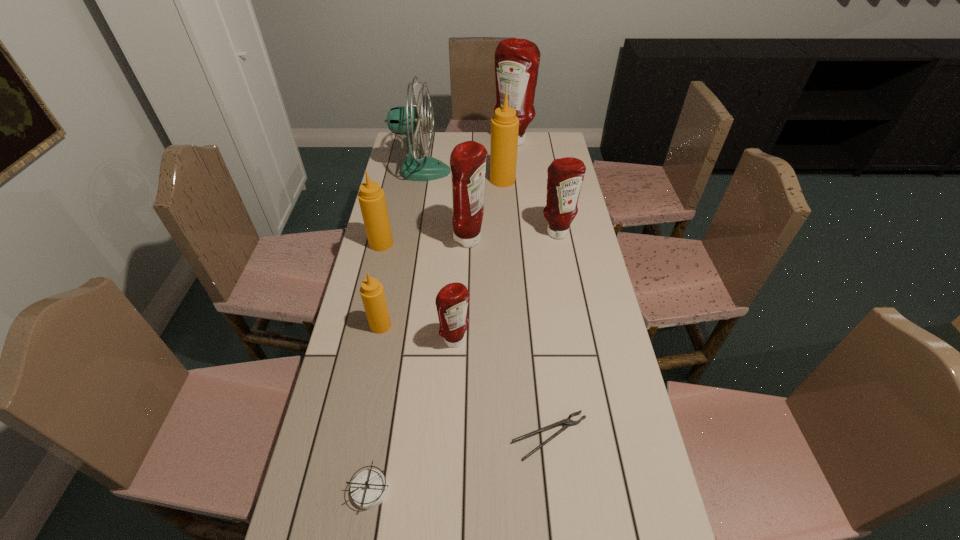
The height and width of the screenshot is (540, 960). Find the location of `the second shortest object`. the second shortest object is located at coordinates click(x=368, y=490).

Locate an element on the screen. Image resolution: width=960 pixels, height=540 pixels. the nearest object is located at coordinates (368, 490).

This screenshot has height=540, width=960. I want to click on the shortest object, so click(x=567, y=422).

Locate an element on the screen. The height and width of the screenshot is (540, 960). tongs is located at coordinates (567, 422).

In order to click on vacant space located 0.080m on the right of the tallest condiment in this screenshot , I will do `click(550, 142)`.

Locate an element on the screen. The height and width of the screenshot is (540, 960). blank area located 0.120m in front of the fan, directing airflow is located at coordinates (478, 171).

You are a GUI agent. You are given a task and a screenshot of the screen. Output one action in this format:
    pyautogui.click(x=<x>, y=<y>)
    Task: Click on the free space located on the right of the farthest tan condiment
    The height and width of the screenshot is (540, 960).
    Given the screenshot: What is the action you would take?
    [x=564, y=180]

This screenshot has height=540, width=960. I want to click on vacant region located on the back of the third smallest red condiment, so click(471, 181).

The width and height of the screenshot is (960, 540). Find the location of `vacant space located on the front of the second nearest tan condiment`. vacant space located on the front of the second nearest tan condiment is located at coordinates (360, 333).

In order to click on vacant space located on the back of the third biggest red condiment in this screenshot , I will do `click(546, 175)`.